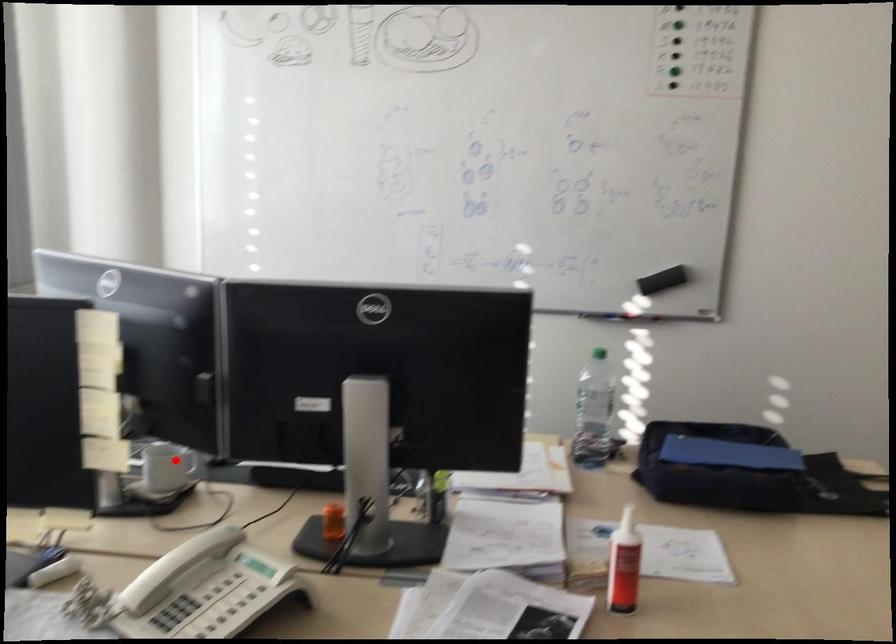
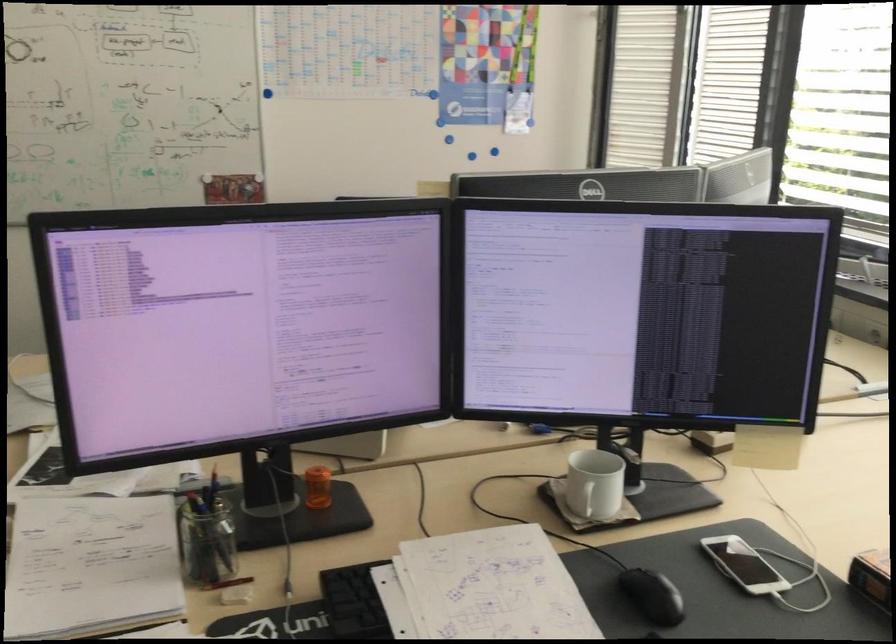
Question: I am providing you with two images of the same scene from different viewpoints. Given a red point in image1, look at the same physical point in image2. Is it:

Choices:
 (A) Closer to the viewpoint
 (B) Farther from the viewpoint

Answer: (A)